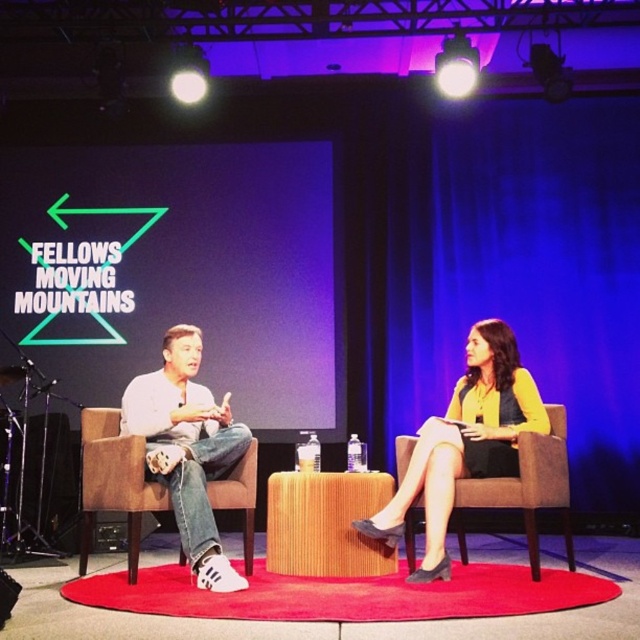
Is point (125, 513) positioned behind point (552, 458)?

Yes.

Does point (131, 580) come in front of point (480, 490)?

That is True.

Identify the location of brown leather chair at center. The image size is (640, 640). (115, 481).

Consider the image. Does yellow fabric dress at center come behind brown fabric chair at center?

No, yellow fabric dress at center is in front of brown fabric chair at center.

Which of these two, yellow fabric dress at center or brown fabric chair at center, stands taller?

yellow fabric dress at center is taller.

Between point (516, 396) and point (548, 449), which one is positioned behind?

Positioned behind is point (516, 396).

The height and width of the screenshot is (640, 640). I want to click on yellow fabric dress at center, so click(465, 442).

Is brown leather chair at center smaller than matte black speaker at left?

Yes, brown leather chair at center is smaller than matte black speaker at left.

Is brown leather chair at center shorter than matte black speaker at left?

Incorrect, brown leather chair at center's height does not fall short of matte black speaker at left's.

The height and width of the screenshot is (640, 640). Identify the location of brown leather chair at center. (115, 481).